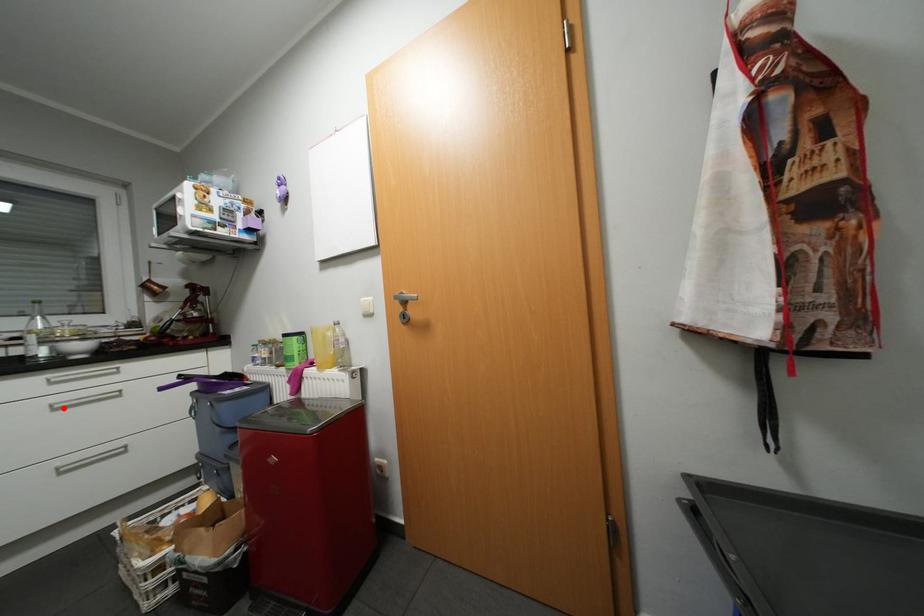
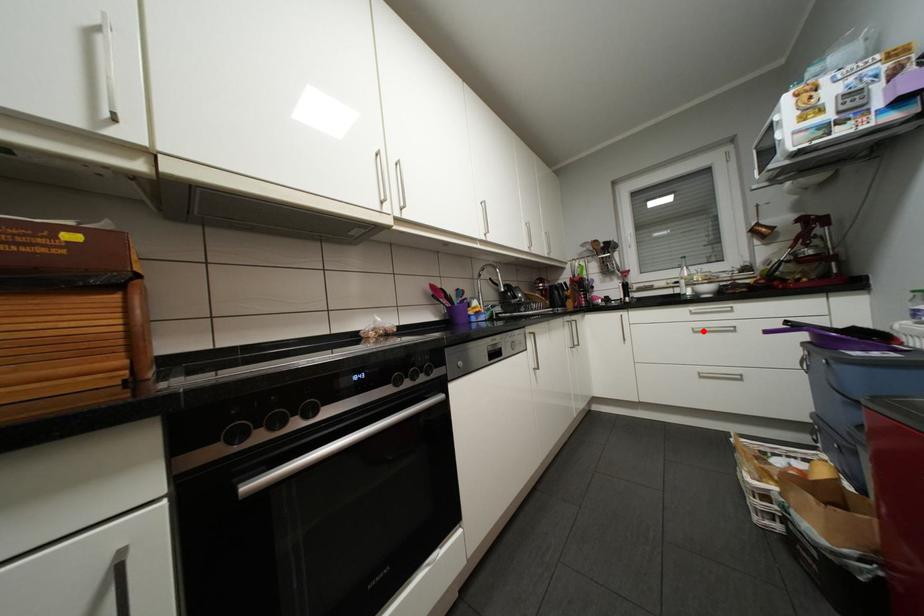
I am providing you with two images of the same scene from different viewpoints. A red point is marked on the first image and another point is marked on the second image. Do the highlighted points in image1 and image2 indicate the same real-world spot?

Yes